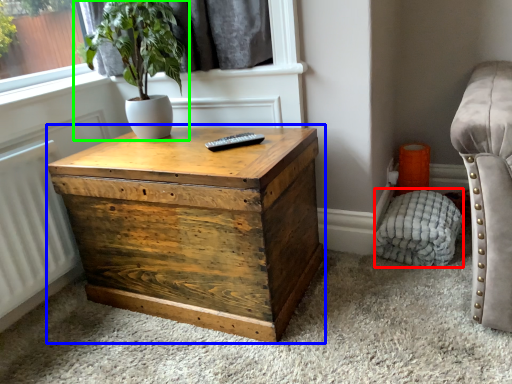
Question: Considering the real-world distances, which object is farthest from swivel chair (highlighted by a red box)? nightstand (highlighted by a blue box) or houseplant (highlighted by a green box)?

Choices:
 (A) nightstand
 (B) houseplant

Answer: (B)